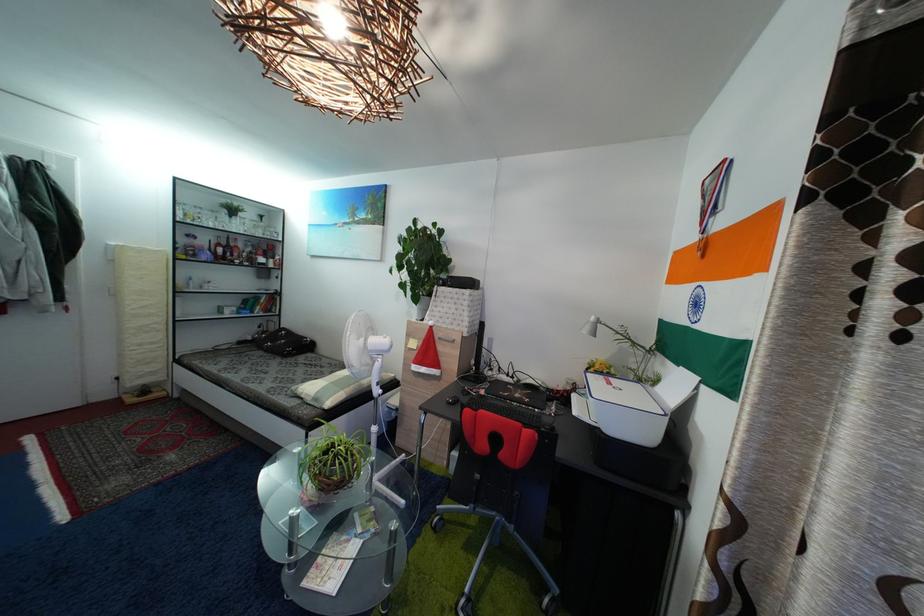
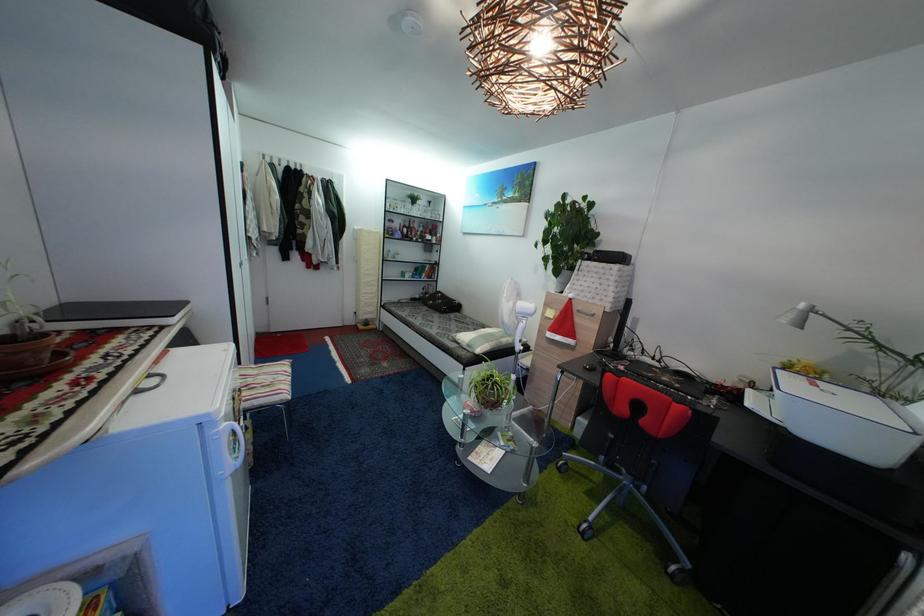
Question: How did the camera likely rotate?

Choices:
 (A) Left
 (B) Right
 (C) Up
 (D) Down

Answer: (A)